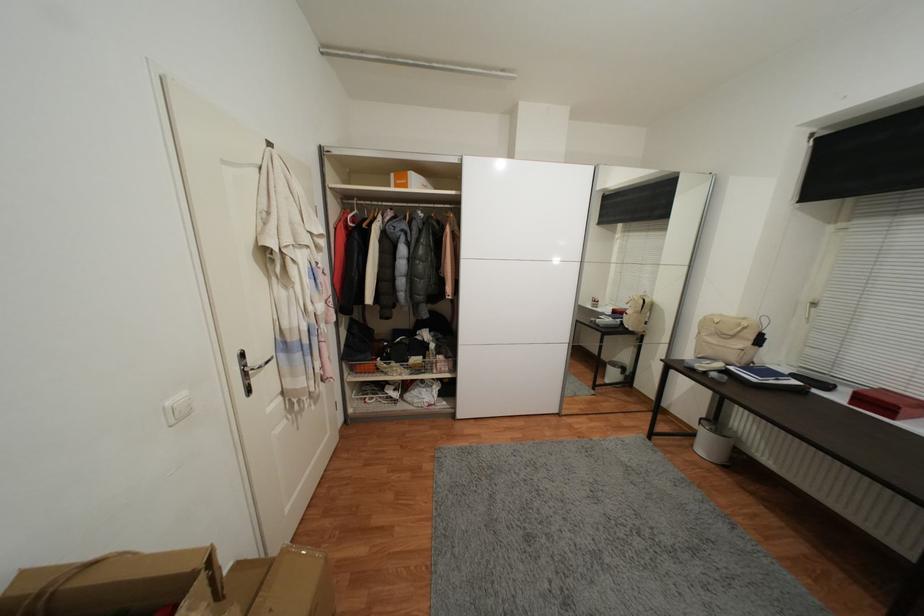
Where is `blue book`? blue book is located at coordinates (766, 378).